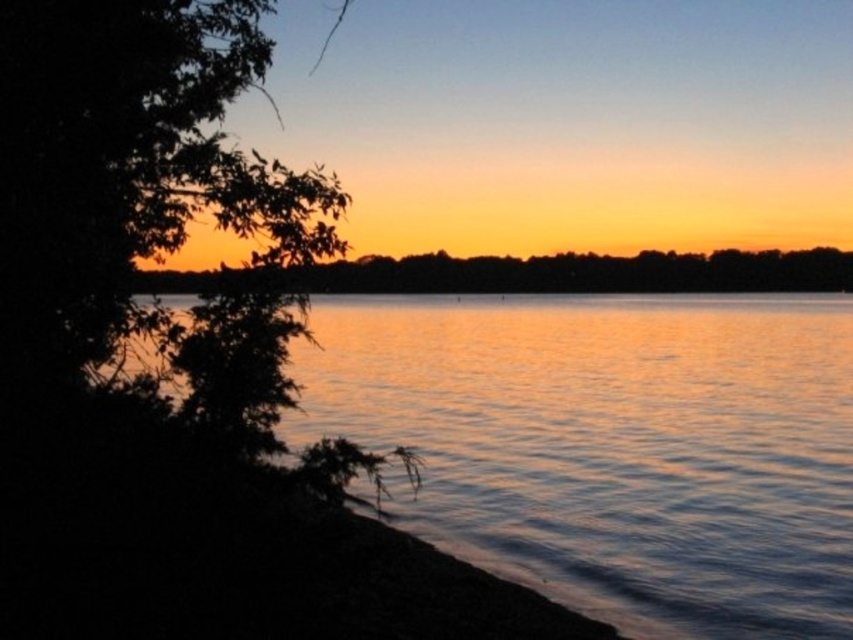
Is shiny reflective water at left below silhouette tree at center?

Correct, shiny reflective water at left is located below silhouette tree at center.

Is point (403, 484) positioned before point (628, 268)?

Yes, point (403, 484) is closer to viewer.

I want to click on shiny reflective water at left, so click(611, 445).